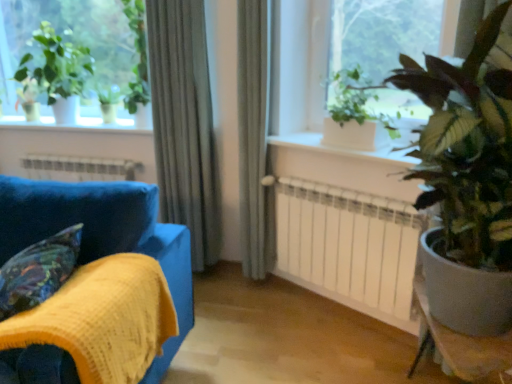
Locate an element on the screen. The height and width of the screenshot is (384, 512). empty space that is ontop of white metallic heater at lower center (from a real-world perspective) is located at coordinates (72, 156).